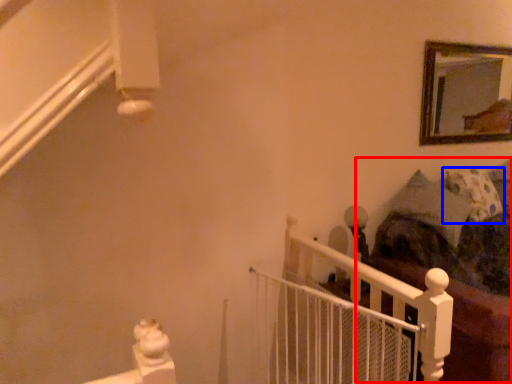
Question: Among these objects, which one is nearest to the camera, bed (highlighted by a red box) or pillow (highlighted by a blue box)?

Choices:
 (A) bed
 (B) pillow

Answer: (A)